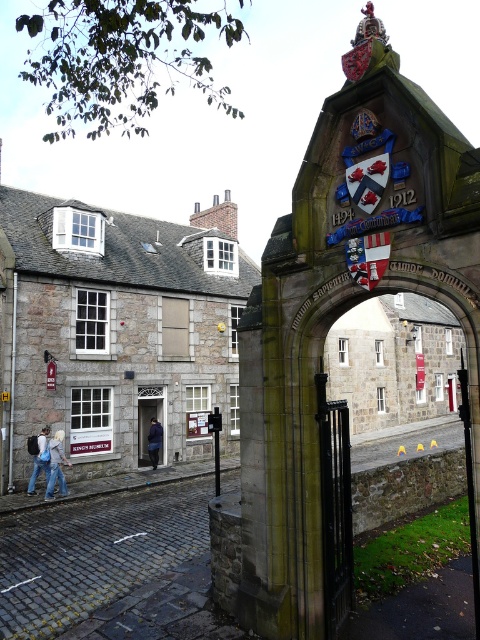
Between stone building at left and stone archway at center, which one appears on the left side from the viewer's perspective?

Positioned to the left is stone building at left.

Between point (127, 408) and point (477, 472), which one is positioned behind?

The point (127, 408) is more distant.

At what (x,y) coordinates should I click in order to perform the action: click on stone building at left. Please return your answer as a coordinate pair (x, y). Looking at the image, I should click on (116, 328).

Does point (313, 356) come farther from viewer compared to point (142, 397)?

No, (313, 356) is closer to viewer.

Can you confirm if stone archway at center is thinner than dark blue fabric door at center?

No, stone archway at center is not thinner than dark blue fabric door at center.

Locate an element on the screen. This screenshot has height=640, width=480. stone archway at center is located at coordinates [x=314, y=342].

Does point (147, 298) come farther from viewer compared to point (39, 468)?

Yes, it is behind point (39, 468).

Does stone building at left appear under denim jeans at lower left?

No, stone building at left is not below denim jeans at lower left.

Identify the location of stone building at left. The height and width of the screenshot is (640, 480). (116, 328).

Find the location of a particular element. This screenshot has width=480, height=640. stone building at left is located at coordinates (116, 328).